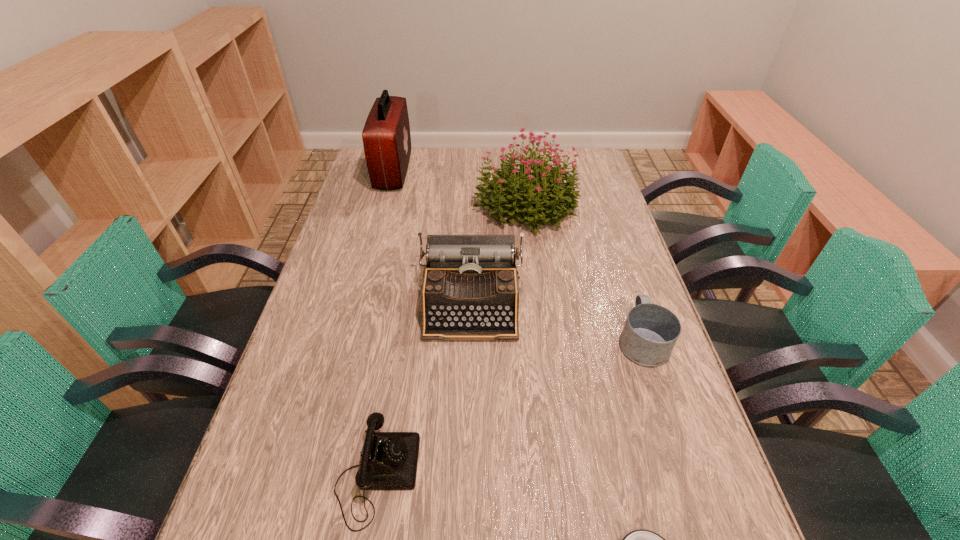
I want to click on free location that satisfies the following two spatial constraints: 1. on the side of the first aid kit with the cross symbol; 2. on the left side of the bouquet, so click(385, 204).